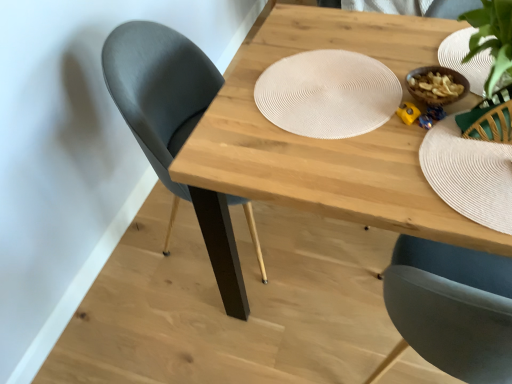
Question: Should I look upward or downward to see white woven placemat at center?

Choices:
 (A) down
 (B) up

Answer: (B)

Question: From a real-world perspective, is white woven placemat at center positioned over natural wood table at center based on gravity?

Choices:
 (A) no
 (B) yes

Answer: (B)

Question: Is white woven placemat at center wider than natural wood table at center?

Choices:
 (A) no
 (B) yes

Answer: (A)

Question: From a real-world perspective, is white woven placemat at center under natural wood table at center?

Choices:
 (A) yes
 (B) no

Answer: (B)

Question: Is white woven placemat at center at the left side of natural wood table at center?

Choices:
 (A) yes
 (B) no

Answer: (A)

Question: Does white woven placemat at center have a greater height compared to natural wood table at center?

Choices:
 (A) no
 (B) yes

Answer: (A)

Question: Would you say natural wood table at center is part of white woven placemat at center's contents?

Choices:
 (A) yes
 (B) no

Answer: (B)

Question: Is white textured paper plate at upper right positioned with its back to matte black chair at left?

Choices:
 (A) no
 (B) yes

Answer: (A)

Question: Considering the relative sizes of white textured paper plate at upper right and matte black chair at left in the image provided, is white textured paper plate at upper right smaller than matte black chair at left?

Choices:
 (A) yes
 (B) no

Answer: (A)

Question: Is white textured paper plate at upper right far from matte black chair at left?

Choices:
 (A) no
 (B) yes

Answer: (A)

Question: Considering the relative positions of white textured paper plate at upper right and matte black chair at left in the image provided, is white textured paper plate at upper right to the left of matte black chair at left from the viewer's perspective?

Choices:
 (A) no
 (B) yes

Answer: (A)

Question: Is the surface of white textured paper plate at upper right in direct contact with matte black chair at left?

Choices:
 (A) yes
 (B) no

Answer: (B)

Question: Can you confirm if white textured paper plate at upper right is thinner than matte black chair at left?

Choices:
 (A) yes
 (B) no

Answer: (A)

Question: Considering the relative sizes of matte black chair at left and white woven placemat at center in the image provided, is matte black chair at left taller than white woven placemat at center?

Choices:
 (A) no
 (B) yes

Answer: (B)